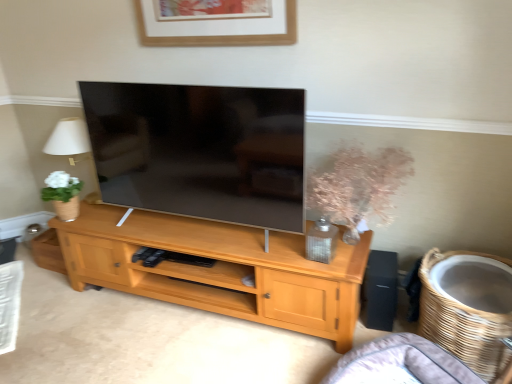
Question: Is point (174, 21) positioned closer to the camera than point (288, 321)?

Choices:
 (A) farther
 (B) closer

Answer: (A)

Question: Relative to light wood cabinet at center, is wooden picture frame at upper center in front or behind?

Choices:
 (A) behind
 (B) front

Answer: (A)

Question: Estimate the real-world distances between objects in this image. Which object is farther from the translucent glass vase at center-right?

Choices:
 (A) woven brown basket at lower right
 (B) black matte speaker at right
 (C) wooden picture frame at upper center
 (D) light wood cabinet at center
 (E) gray fabric couch at lower right

Answer: (C)

Question: Considering the real-world distances, which object is closest to the translucent glass vase at center-right?

Choices:
 (A) woven brown basket at lower right
 (B) black matte speaker at right
 (C) wooden picture frame at upper center
 (D) light wood cabinet at center
 (E) gray fabric couch at lower right

Answer: (B)